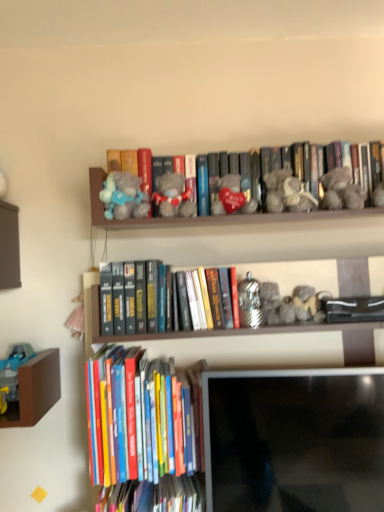
Question: Would you say hardcover books at lower left, the second book viewed from the top, is to the left or to the right of fluffy gray teddy bear at upper center, the first toy positioned from the left, in the picture?

Choices:
 (A) right
 (B) left

Answer: (A)

Question: Is point (157, 379) positioned closer to the camera than point (100, 195)?

Choices:
 (A) closer
 (B) farther

Answer: (A)

Question: Which of these objects is positioned closest to the velvet heart at center, acting as the 2th toy starting from the right?

Choices:
 (A) hardcover books at lower left, positioned as the 2th book in bottom-to-top order
 (B) fluffy gray teddy bear at upper center, the first toy positioned from the left
 (C) fluffy plush bear at center, arranged as the third toy when viewed from the right
 (D) gray plush bear at center, the third book ordered from the bottom
 (E) matte black monitor at lower center

Answer: (C)

Question: Considering the real-world distances, which object is closest to the matte black monitor at lower center?

Choices:
 (A) velvet heart at center, marked as the 3th toy in a left-to-right arrangement
 (B) fluffy gray teddy bear at upper center, the fourth toy viewed from the right
 (C) fluffy plush bear at center, the second toy viewed from the left
 (D) fuzzy gray teddy bear at upper right, the fourth toy when ordered from left to right
 (E) hardcover books at lower left, the second book viewed from the top

Answer: (E)